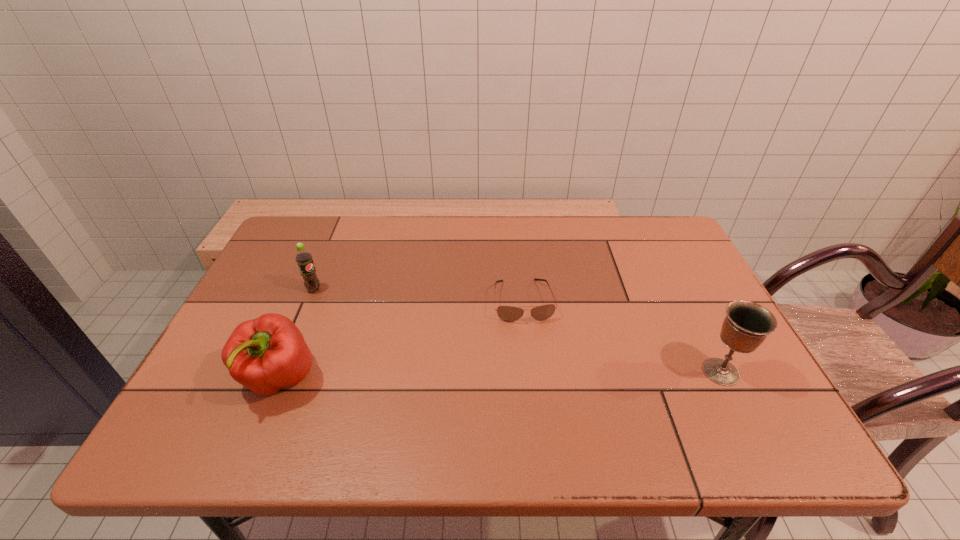
Identify the location of vacant region between the rightmost object and the shortest object. (622, 336).

You are a GUI agent. You are given a task and a screenshot of the screen. Output one action in this format:
    pyautogui.click(x=<x>, y=<y>)
    Task: Click on the vacant space that's between the chalice and the bell pepper
    
    Given the screenshot: What is the action you would take?
    pyautogui.click(x=500, y=375)

Identify the location of the second closest object to the shortest object. This screenshot has height=540, width=960. (266, 354).

At what (x,y) coordinates should I click in order to perform the action: click on object that is the closest one to the third object from left to right. Please return your answer as a coordinate pair (x, y). The height and width of the screenshot is (540, 960). Looking at the image, I should click on (746, 325).

The height and width of the screenshot is (540, 960). In order to click on vacant area in the image that satisfies the following two spatial constraints: 1. on the front side of the soda; 2. on the right side of the second object from right to left in this screenshot , I will do `click(309, 301)`.

Locate an element on the screen. free space that satisfies the following two spatial constraints: 1. on the front side of the bell pepper; 2. on the left side of the soda is located at coordinates (276, 379).